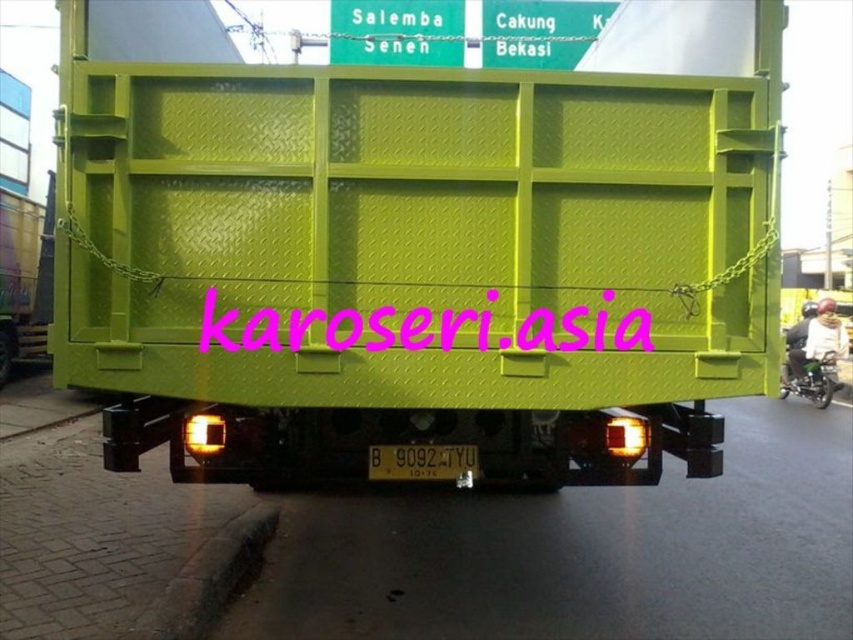
Which is behind, point (607, 164) or point (837, 358)?

The point (837, 358) is more distant.

The image size is (853, 640). I want to click on matte green container at center, so click(415, 260).

The image size is (853, 640). I want to click on matte green container at center, so click(415, 260).

Between point (579, 310) and point (425, 449), which one is positioned in front?

Positioned in front is point (579, 310).

Is pink text at center taller than black plastic license plate at center?

Yes.

You are a GUI agent. You are given a task and a screenshot of the screen. Output one action in this format:
    pyautogui.click(x=<x>, y=<y>)
    Task: Click on the pink text at center
    This screenshot has height=640, width=853.
    Given the screenshot: What is the action you would take?
    pyautogui.click(x=421, y=330)

Image resolution: width=853 pixels, height=640 pixels. What do you see at coordinates (421, 330) in the screenshot?
I see `pink text at center` at bounding box center [421, 330].

Measure the distance between pink text at center and green metallic motorcycle at lower right.

pink text at center and green metallic motorcycle at lower right are 10.58 meters apart from each other.

This screenshot has width=853, height=640. In order to click on pink text at center in this screenshot , I will do `click(421, 330)`.